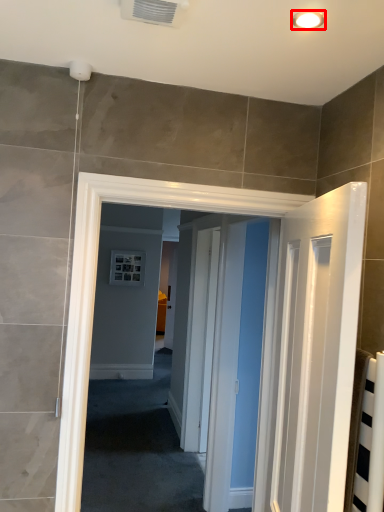
Question: From the image's perspective, considering the relative positions of light fixture (annotated by the red box) and air conditioning in the image provided, where is light fixture (annotated by the red box) located with respect to the staircase?

Choices:
 (A) above
 (B) below

Answer: (B)